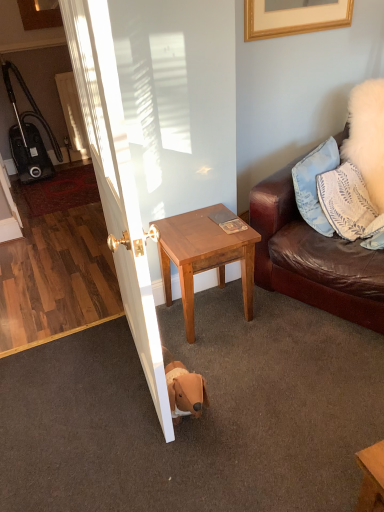
Identify the location of white fluffy pillow at upper right, placed as the 1th pillow when sorted from top to bottom. (367, 137).

The height and width of the screenshot is (512, 384). What do you see at coordinates (367, 137) in the screenshot?
I see `white fluffy pillow at upper right, which is the 2th pillow from bottom to top` at bounding box center [367, 137].

The height and width of the screenshot is (512, 384). What are the coordinates of `light brown wood side table at center` in the screenshot? It's located at (203, 257).

Is white glossy door at center located outside light brown wood side table at center?

Yes, white glossy door at center is not within light brown wood side table at center.

Between point (103, 118) and point (166, 264), which one is positioned in front?

The point (103, 118) is closer to the camera.

How different are the orientations of white glossy door at center and light brown wood side table at center in degrees?

They differ by 4.15 degrees in their facing directions.

From a real-world perspective, who is located higher, white fluffy pillow at upper right, which is the 2th pillow from bottom to top, or black plastic vacuum cleaner at left?

In real-world perspective, white fluffy pillow at upper right, which is the 2th pillow from bottom to top, is above.

Looking at this image, considering the sizes of white fluffy pillow at upper right, which is the 2th pillow from bottom to top, and black plastic vacuum cleaner at left in the image, is white fluffy pillow at upper right, which is the 2th pillow from bottom to top, wider or thinner than black plastic vacuum cleaner at left?

white fluffy pillow at upper right, which is the 2th pillow from bottom to top, is wider than black plastic vacuum cleaner at left.

In the scene shown: Measure the distance between white fluffy pillow at upper right, placed as the 1th pillow when sorted from top to bottom, and black plastic vacuum cleaner at left.

white fluffy pillow at upper right, placed as the 1th pillow when sorted from top to bottom, is 2.84 meters from black plastic vacuum cleaner at left.

Visually, is white fluffy pillow at upper right, which is the 2th pillow from bottom to top, positioned to the left or to the right of black plastic vacuum cleaner at left?

From the image, it's evident that white fluffy pillow at upper right, which is the 2th pillow from bottom to top, is to the right of black plastic vacuum cleaner at left.

Is light brown wood side table at center positioned behind white glossy door at center?

Yes, it is.

Can you confirm if light brown wood side table at center is shorter than white glossy door at center?

Yes, light brown wood side table at center is shorter than white glossy door at center.

Which point is more distant from viewer, (x=243, y=243) or (x=98, y=61)?

The point (x=243, y=243) is more distant.

From the image's perspective, which is below, white glossy door at center or white fluffy pillow at upper right, placed as the 1th pillow when sorted from top to bottom?

white glossy door at center.

Is white glossy door at center far away from white fluffy pillow at upper right, which is the 2th pillow from bottom to top?

Absolutely, white glossy door at center is distant from white fluffy pillow at upper right, which is the 2th pillow from bottom to top.

Which is less distant, (146, 345) or (376, 168)?

Point (146, 345) is positioned closer to the camera compared to point (376, 168).

Is white glossy door at center inside or outside of white fluffy pillow at upper right, placed as the 1th pillow when sorted from top to bottom?

white glossy door at center is spatially situated outside white fluffy pillow at upper right, placed as the 1th pillow when sorted from top to bottom.

Is blue fabric pillow at upper right, placed as the second pillow when sorted from top to bottom, taller or shorter than light brown wood side table at center?

blue fabric pillow at upper right, placed as the second pillow when sorted from top to bottom, is taller than light brown wood side table at center.

Between point (357, 236) and point (251, 285), which one is positioned behind?

The point (251, 285) is farther from the camera.

Where is `table below the blue fabric pillow at upper right, placed as the second pillow when sorted from top to bottom (from a real-world perspective)`? The height and width of the screenshot is (512, 384). table below the blue fabric pillow at upper right, placed as the second pillow when sorted from top to bottom (from a real-world perspective) is located at coordinates (203, 257).

Consider the image. From a real-world perspective, is blue fabric pillow at upper right, placed as the second pillow when sorted from top to bottom, over light brown wood side table at center?

Yes, from a real-world perspective, blue fabric pillow at upper right, placed as the second pillow when sorted from top to bottom, is on top of light brown wood side table at center.

Which of these two, blue fabric pillow at upper right, placed as the second pillow when sorted from top to bottom, or white fluffy pillow at upper right, which is the 2th pillow from bottom to top, is wider?

white fluffy pillow at upper right, which is the 2th pillow from bottom to top.

How different are the orientations of blue fabric pillow at upper right, placed as the second pillow when sorted from top to bottom, and white fluffy pillow at upper right, placed as the 1th pillow when sorted from top to bottom, in degrees?

The angle between the facing direction of blue fabric pillow at upper right, placed as the second pillow when sorted from top to bottom, and the facing direction of white fluffy pillow at upper right, placed as the 1th pillow when sorted from top to bottom, is 92.2 degrees.

Who is bigger, blue fabric pillow at upper right, placed as the second pillow when sorted from top to bottom, or white fluffy pillow at upper right, which is the 2th pillow from bottom to top?

Bigger between the two is white fluffy pillow at upper right, which is the 2th pillow from bottom to top.

Does blue fabric pillow at upper right, positioned as the first pillow in bottom-to-top order, contain white fluffy pillow at upper right, placed as the 1th pillow when sorted from top to bottom?

No, blue fabric pillow at upper right, positioned as the first pillow in bottom-to-top order, does not contain white fluffy pillow at upper right, placed as the 1th pillow when sorted from top to bottom.

Does light brown wood side table at center touch white fluffy pillow at upper right, which is the 2th pillow from bottom to top?

No, light brown wood side table at center is not beside white fluffy pillow at upper right, which is the 2th pillow from bottom to top.

Considering the relative positions of light brown wood side table at center and white fluffy pillow at upper right, placed as the 1th pillow when sorted from top to bottom, in the image provided, is light brown wood side table at center in front of white fluffy pillow at upper right, placed as the 1th pillow when sorted from top to bottom,?

Yes, it is in front of white fluffy pillow at upper right, placed as the 1th pillow when sorted from top to bottom.

Considering the sizes of light brown wood side table at center and white fluffy pillow at upper right, placed as the 1th pillow when sorted from top to bottom, in the image, is light brown wood side table at center bigger or smaller than white fluffy pillow at upper right, placed as the 1th pillow when sorted from top to bottom,?

In the image, light brown wood side table at center appears to be smaller than white fluffy pillow at upper right, placed as the 1th pillow when sorted from top to bottom.

From a real-world perspective, does light brown wood side table at center sit lower than white fluffy pillow at upper right, placed as the 1th pillow when sorted from top to bottom?

Correct, in the physical world, light brown wood side table at center is lower than white fluffy pillow at upper right, placed as the 1th pillow when sorted from top to bottom.

The width and height of the screenshot is (384, 512). What are the coordinates of `door on the left of light brown wood side table at center` in the screenshot? It's located at (116, 183).

Locate an element on the screen. The image size is (384, 512). luggage above the white fluffy pillow at upper right, placed as the 1th pillow when sorted from top to bottom (from the image's perspective) is located at coordinates coord(28,135).

Considering their positions, is white fluffy pillow at upper right, which is the 2th pillow from bottom to top, positioned closer to white glossy door at center than blue fabric pillow at upper right, placed as the second pillow when sorted from top to bottom?

Based on the image, blue fabric pillow at upper right, placed as the second pillow when sorted from top to bottom, appears to be nearer to white glossy door at center.

Based on their spatial positions, is white glossy door at center or light brown wood side table at center further from black plastic vacuum cleaner at left?

white glossy door at center.

From the picture: Considering their positions, is light brown wood side table at center positioned closer to black plastic vacuum cleaner at left than white fluffy pillow at upper right, which is the 2th pillow from bottom to top?

Based on the image, light brown wood side table at center appears to be nearer to black plastic vacuum cleaner at left.

Estimate the real-world distances between objects in this image. Which object is further from white glossy door at center, black plastic vacuum cleaner at left or white fluffy pillow at upper right, which is the 2th pillow from bottom to top?

The object further to white glossy door at center is black plastic vacuum cleaner at left.

From the image, which object appears to be farther from white glossy door at center, white fluffy pillow at upper right, which is the 2th pillow from bottom to top, or black plastic vacuum cleaner at left?

black plastic vacuum cleaner at left.

Looking at the image, which one is located closer to white glossy door at center, light brown wood side table at center or black plastic vacuum cleaner at left?

The object closer to white glossy door at center is light brown wood side table at center.

Based on their spatial positions, is white fluffy pillow at upper right, which is the 2th pillow from bottom to top, or black plastic vacuum cleaner at left closer to blue fabric pillow at upper right, positioned as the first pillow in bottom-to-top order?

Among the two, white fluffy pillow at upper right, which is the 2th pillow from bottom to top, is located nearer to blue fabric pillow at upper right, positioned as the first pillow in bottom-to-top order.

Estimate the real-world distances between objects in this image. Which object is closer to blue fabric pillow at upper right, positioned as the first pillow in bottom-to-top order, light brown wood side table at center or white glossy door at center?

The object closer to blue fabric pillow at upper right, positioned as the first pillow in bottom-to-top order, is light brown wood side table at center.

Image resolution: width=384 pixels, height=512 pixels. What are the coordinates of `pillow located between white glossy door at center and white fluffy pillow at upper right, which is the 2th pillow from bottom to top, in the left-right direction` in the screenshot? It's located at (350, 206).

Find the location of a particular element. table between white glossy door at center and white fluffy pillow at upper right, which is the 2th pillow from bottom to top, from left to right is located at coordinates (203, 257).

Where is `table situated between black plastic vacuum cleaner at left and white fluffy pillow at upper right, placed as the 1th pillow when sorted from top to bottom, from left to right`? table situated between black plastic vacuum cleaner at left and white fluffy pillow at upper right, placed as the 1th pillow when sorted from top to bottom, from left to right is located at coordinates (203, 257).

I want to click on table between white glossy door at center and blue fabric pillow at upper right, positioned as the first pillow in bottom-to-top order, in the front-back direction, so click(x=203, y=257).